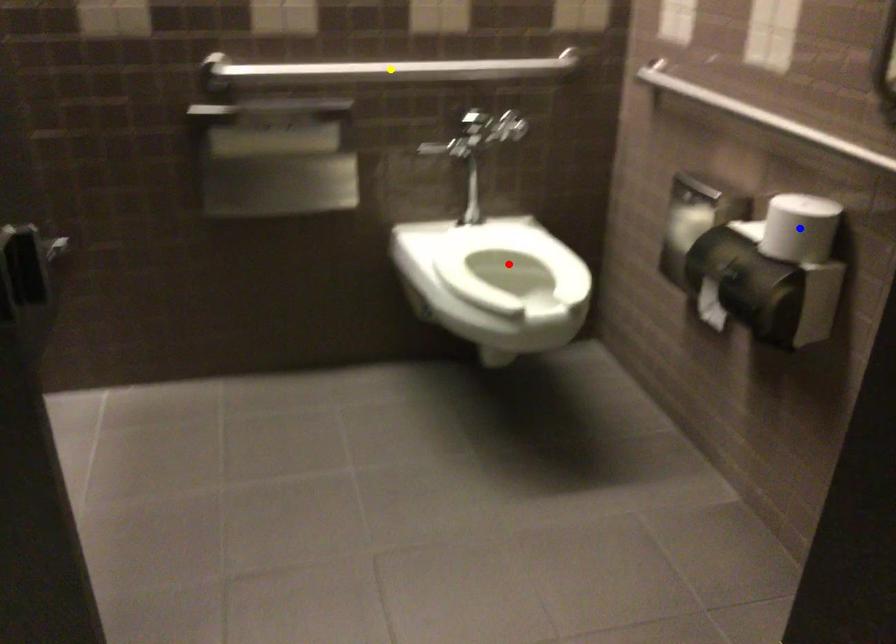
In the scene shown: Order these from nearest to farthest:
blue point
red point
yellow point

1. blue point
2. yellow point
3. red point